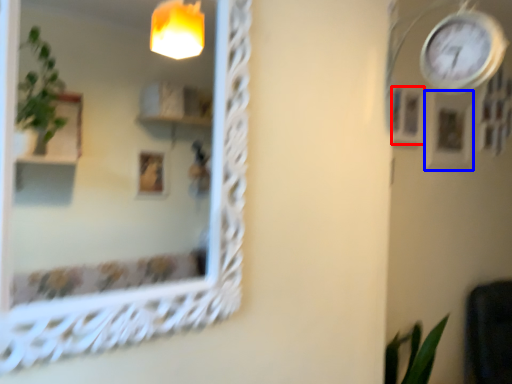
Question: Which object appears farthest to the camera in this image, picture frame (highlighted by a red box) or picture frame (highlighted by a blue box)?

Choices:
 (A) picture frame
 (B) picture frame

Answer: (B)